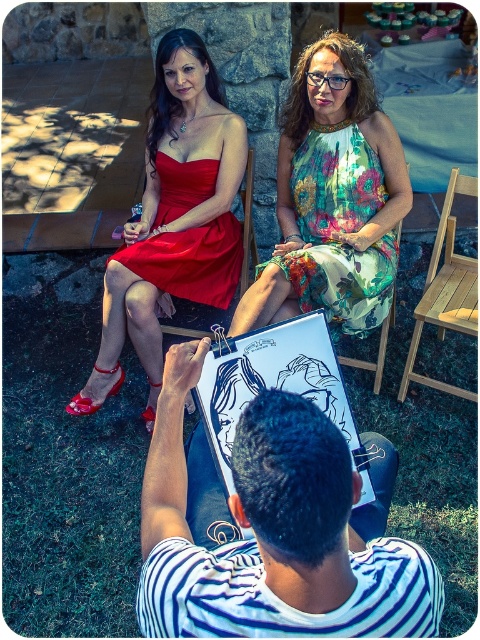
You are a photographer trying to capture a clear shot of both the floral printed dress at upper center and the matte red dress at upper left. Based on their positions, which dress is closer to the camera?

The floral printed dress at upper center is closer to the camera because it is in front of the matte red dress at upper left.